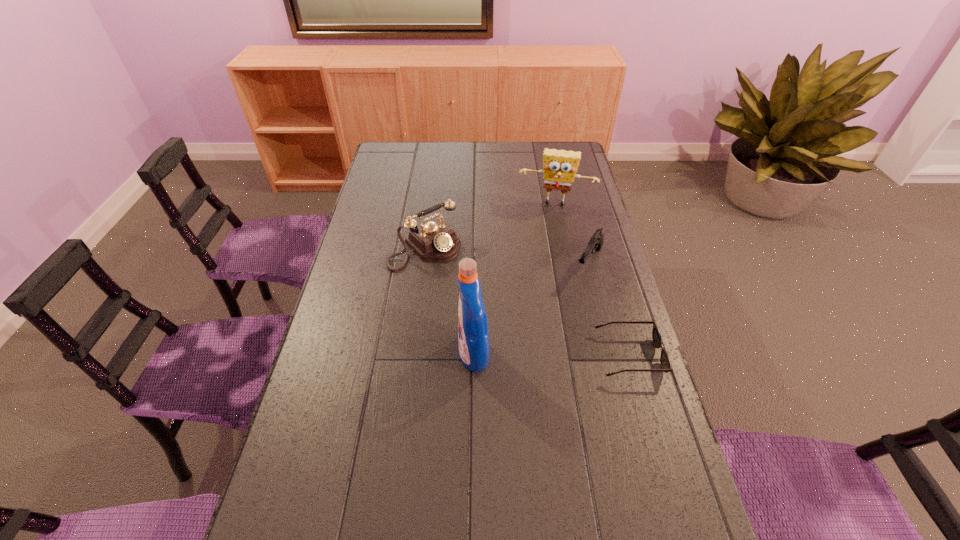
At what (x,y) coordinates should I click in order to perform the action: click on the second object from left to right. Please return your answer as a coordinate pair (x, y). The width and height of the screenshot is (960, 540). Looking at the image, I should click on (473, 337).

You are a GUI agent. You are given a task and a screenshot of the screen. Output one action in this format:
    pyautogui.click(x=<x>, y=<y>)
    Task: Click on the detergent
    This screenshot has height=540, width=960.
    Given the screenshot: What is the action you would take?
    pyautogui.click(x=473, y=337)

This screenshot has width=960, height=540. I want to click on the shortest object, so click(x=665, y=361).

Where is `the leftmost object`? This screenshot has width=960, height=540. the leftmost object is located at coordinates (435, 241).

Find the location of a particular element. This screenshot has height=540, width=960. telephone is located at coordinates (435, 241).

Locate an element on the screen. the farthest object is located at coordinates (560, 166).

Find the location of a particular element. This screenshot has height=540, width=960. sponge is located at coordinates (560, 166).

Identify the location of gun. This screenshot has height=540, width=960. (596, 242).

Where is `vacant region located 0.230m on the label of the tallest object`? vacant region located 0.230m on the label of the tallest object is located at coordinates (374, 355).

Find the location of `free space located on the label of the tallest object`. free space located on the label of the tallest object is located at coordinates (429, 355).